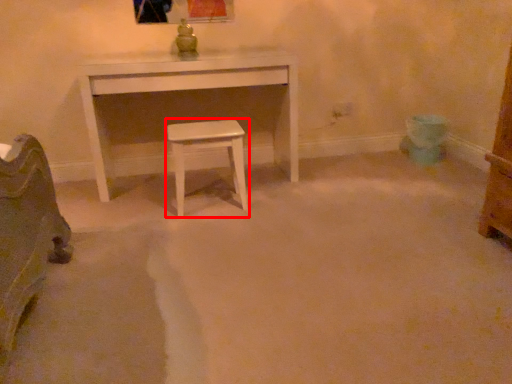
Question: Where is stool (annotated by the red box) located in relation to table in the image?

Choices:
 (A) left
 (B) right

Answer: (B)